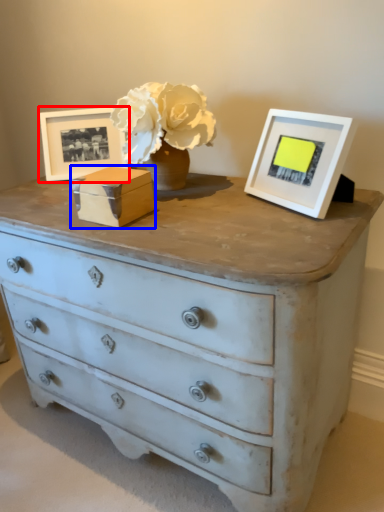
Question: Which of the following is the farthest to the observer, picture frame (highlighted by a red box) or box (highlighted by a blue box)?

Choices:
 (A) picture frame
 (B) box

Answer: (A)